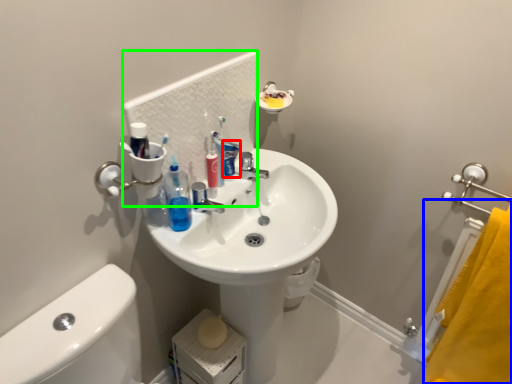
Question: Which object is positioned farthest from toothpaste (highlighted by a red box)? Select from bath towel (highlighted by a blue box) and mirror (highlighted by a green box).

Choices:
 (A) bath towel
 (B) mirror

Answer: (A)